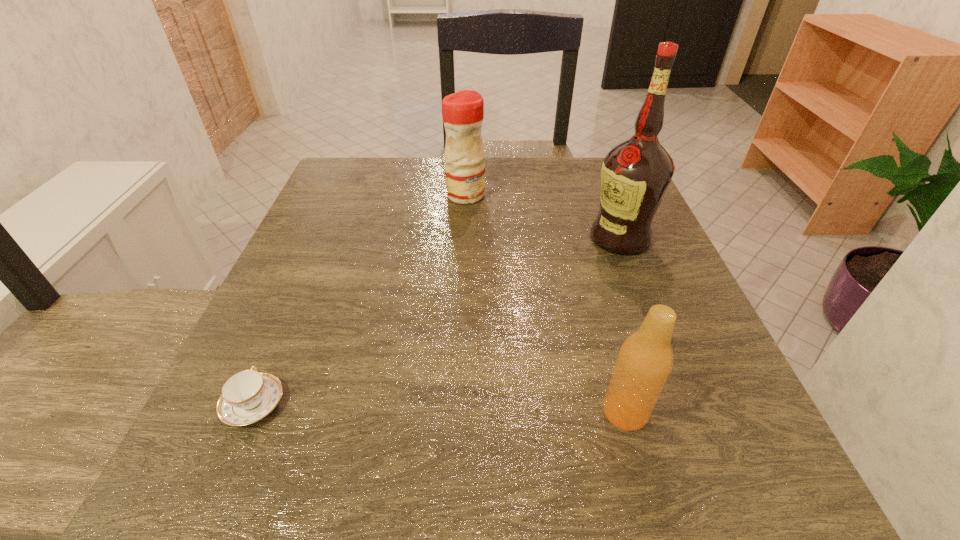
Find the location of `vacant space that satisfies the following two spatial constraints: 1. on the front side of the second shortest object; 2. on the left side of the farthest object`. vacant space that satisfies the following two spatial constraints: 1. on the front side of the second shortest object; 2. on the left side of the farthest object is located at coordinates click(x=456, y=412).

You are a GUI agent. You are given a task and a screenshot of the screen. Output one action in this format:
    pyautogui.click(x=<x>, y=<y>)
    Task: Click on the free point that satisfies the following two spatial constraints: 1. on the side with the handle of the shortest object; 2. on the right side of the condiment
    The image size is (960, 540).
    Given the screenshot: What is the action you would take?
    pyautogui.click(x=344, y=195)